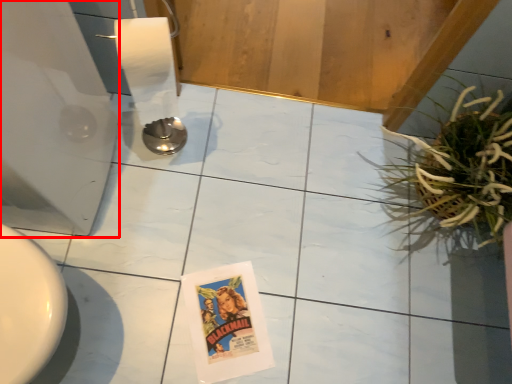
Question: From the image's perspective, what is the correct spatial relationship of appliance (annotated by the red box) in relation to houseplant?

Choices:
 (A) above
 (B) below

Answer: (A)